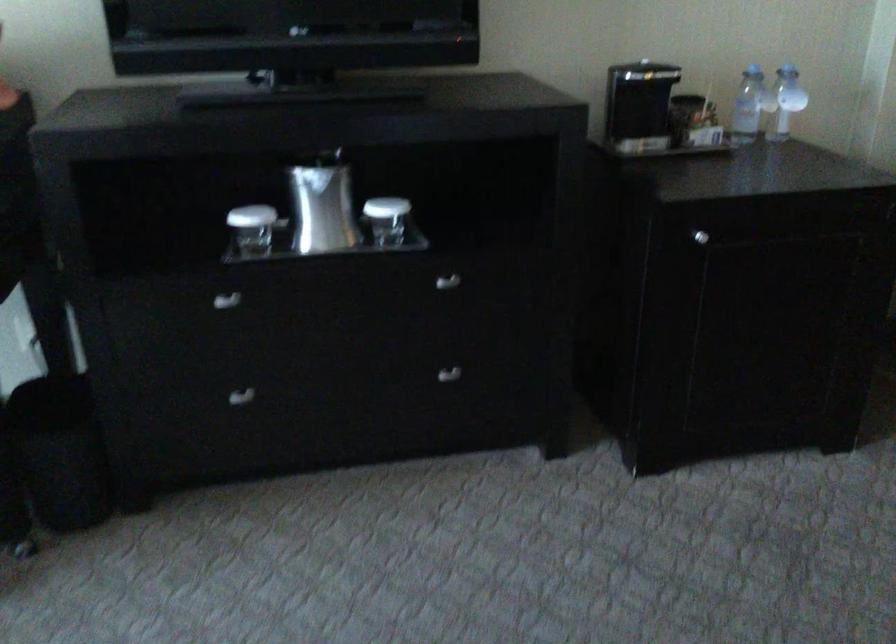
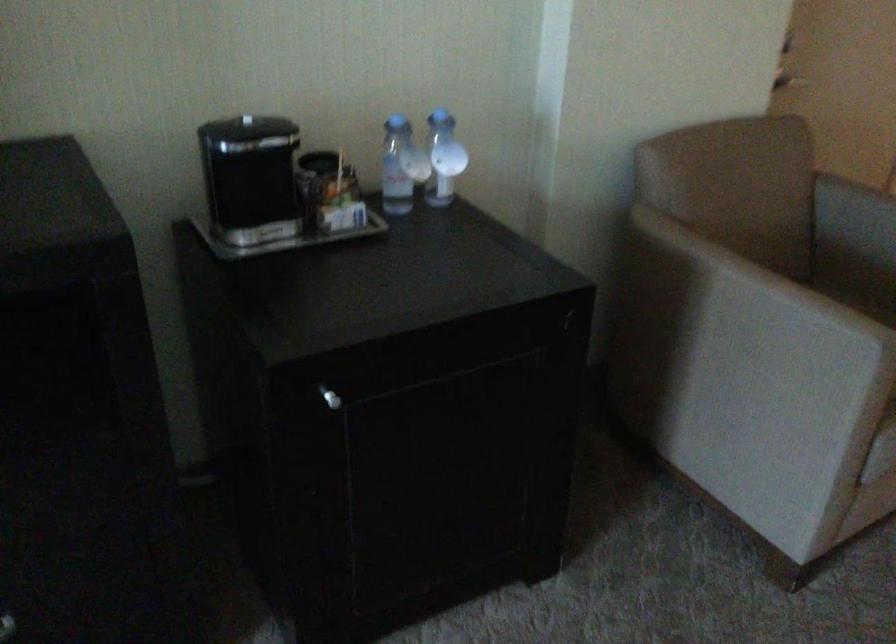
Find the pixel in the second image that matches point (693, 230) in the first image.

(330, 398)